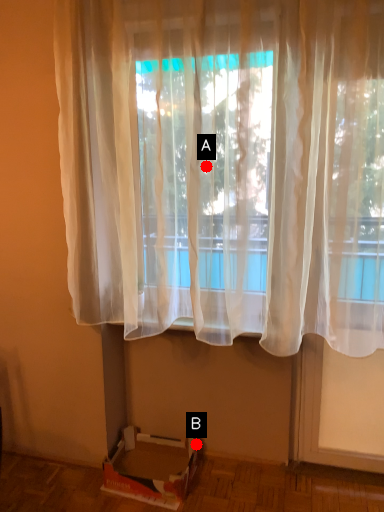
Question: Two points are circled on the image, labeled by A and B beside each circle. Which point is closer to the camera taking this photo?

Choices:
 (A) A is closer
 (B) B is closer

Answer: (A)